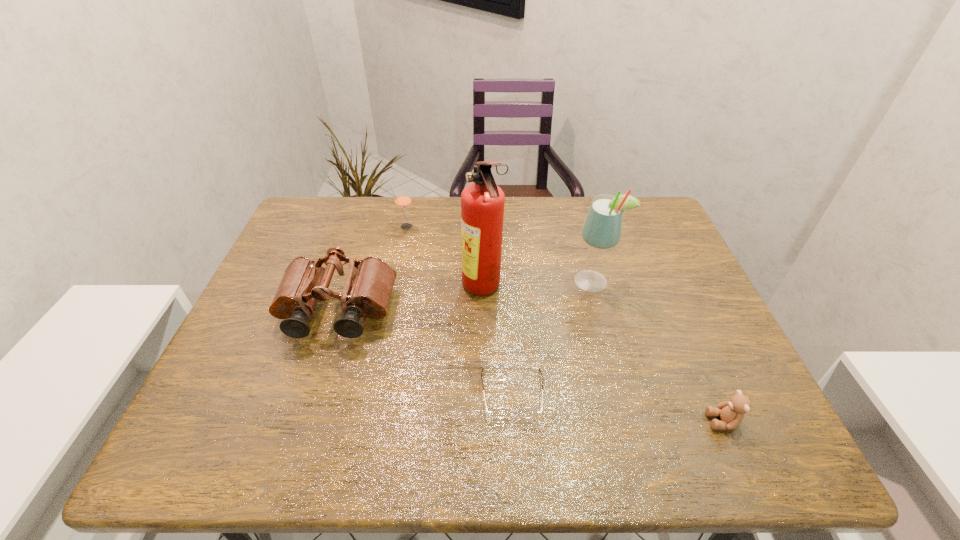
The width and height of the screenshot is (960, 540). Identify the location of object that is at the right edge. (731, 412).

Where is `object located in the near right corner section of the desktop`? The height and width of the screenshot is (540, 960). object located in the near right corner section of the desktop is located at coordinates (731, 412).

In the image, there is a desktop. Where is `free space at the far edge`? This screenshot has height=540, width=960. free space at the far edge is located at coordinates (356, 217).

The image size is (960, 540). I want to click on vacant space at the near edge of the desktop, so click(x=601, y=449).

Find the location of a particular element. The width and height of the screenshot is (960, 540). blank space at the left edge of the desktop is located at coordinates (277, 396).

The height and width of the screenshot is (540, 960). What are the coordinates of `free location at the right edge of the desktop` in the screenshot? It's located at (675, 306).

I want to click on free spot at the far left corner of the desktop, so click(x=324, y=201).

Where is `vacant space at the far right corner of the desktop`? This screenshot has height=540, width=960. vacant space at the far right corner of the desktop is located at coordinates point(666,228).

Where is `vacant area that lies between the tallest object and the shortest object`? The width and height of the screenshot is (960, 540). vacant area that lies between the tallest object and the shortest object is located at coordinates (497, 341).

Identify the location of vacant space that is in between the fifth object from left to right and the fire extinguisher. The height and width of the screenshot is (540, 960). (538, 286).